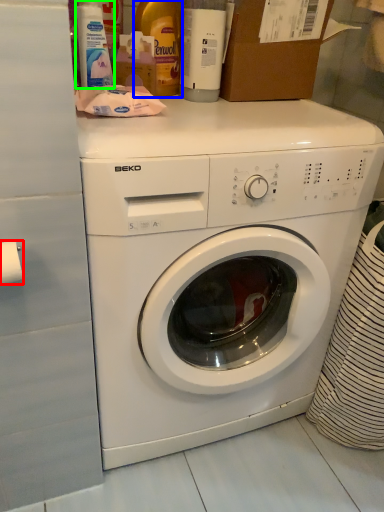
Question: Which is nearer to the toilet paper (highlighted by a red box)? bottle (highlighted by a blue box) or cleaning product (highlighted by a green box).

Choices:
 (A) bottle
 (B) cleaning product

Answer: (B)